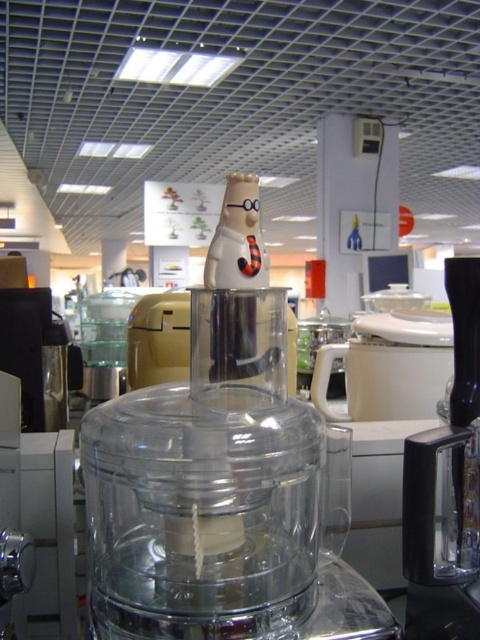
You are a customer in the kitchen appliance section of a store. You see the transparent plastic mixer at center and the black plastic blender at center. Which one is closer to you?

The transparent plastic mixer at center is closer to you because it is in front of the black plastic blender at center.

From the picture: You are standing in the kitchen appliance store and see the transparent plastic mixer at center. If you want to place a sticker exactly at its center, what coordinates should you aim for?

The transparent plastic mixer at center is located at coordinates point (224, 486), so you should aim for those coordinates to place the sticker exactly at its center.

You are a customer in a kitchen appliance store. You see the transparent plastic mixer at center and the black plastic blender at center. Which one is taller?

The transparent plastic mixer at center is taller than the black plastic blender at center.